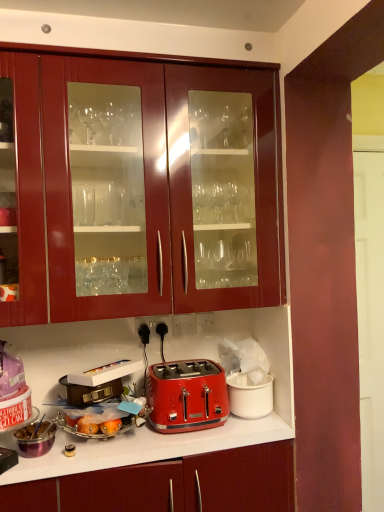
Locate an element on the screen. Image resolution: width=384 pixels, height=512 pixels. free space to the right of metallic silver bowl at lower left, the 1th appliance viewed from the left is located at coordinates (81, 454).